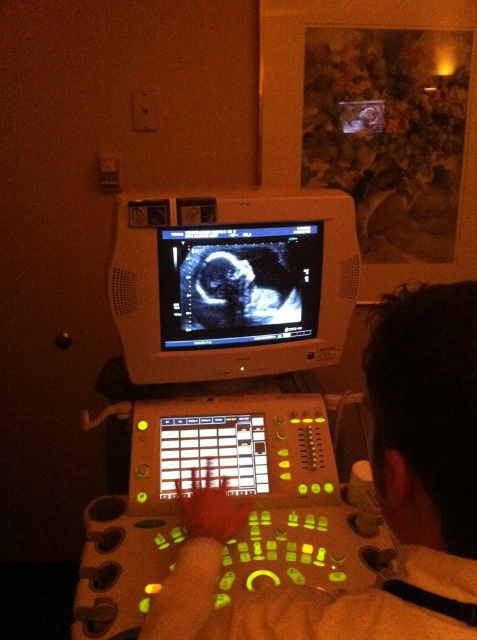
Does skinny white shirt at center appear under gray/white ultrasound image at center?

Correct, skinny white shirt at center is located below gray/white ultrasound image at center.

Does point (166, 604) lie behind point (298, 285)?

No, (166, 604) is closer to viewer.

Is point (403, 323) in front of point (210, 278)?

That is True.

The width and height of the screenshot is (477, 640). Find the location of `skinny white shirt at center`. skinny white shirt at center is located at coordinates (376, 497).

Which is more to the left, skinny white shirt at center or white glossy monitor at center?

From the viewer's perspective, white glossy monitor at center appears more on the left side.

In the scene shown: Which of these two, skinny white shirt at center or white glossy monitor at center, stands shorter?

Standing shorter between the two is skinny white shirt at center.

I want to click on skinny white shirt at center, so click(x=376, y=497).

Does white glossy monitor at center have a greater width compared to gray/white ultrasound image at center?

Correct, the width of white glossy monitor at center exceeds that of gray/white ultrasound image at center.

Image resolution: width=477 pixels, height=640 pixels. Identify the location of white glossy monitor at center. (232, 284).